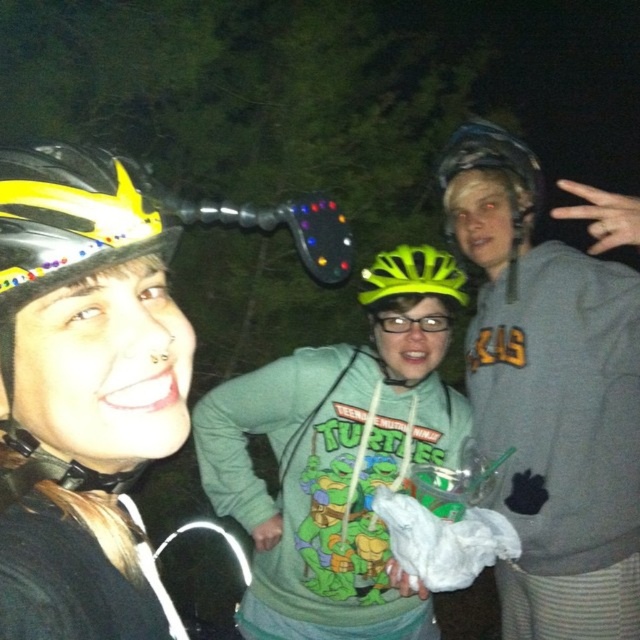
Can you confirm if green matte helmet at center is taller than green matte glasses at center?

Yes, green matte helmet at center is taller than green matte glasses at center.

Does green matte helmet at center appear under green matte glasses at center?

No.

Who is more distant from viewer, (426, 248) or (433, 316)?

Point (426, 248)

What are the coordinates of `green matte helmet at center` in the screenshot? It's located at (412, 275).

Can you confirm if yellow shiny helmet at left is bigger than yellow matte bicycle helmet at left?

Yes.

Does point (140, 186) come farther from viewer compared to point (13, 276)?

Yes, point (140, 186) is farther from viewer.

I want to click on yellow shiny helmet at left, so point(64,248).

Is point (122, 232) positioned before point (448, 330)?

Yes, it is in front of point (448, 330).

Is point (36, 192) more distant than point (429, 330)?

No, (36, 192) is in front of (429, 330).

Is point (172, 240) positioned after point (392, 316)?

No, (172, 240) is in front of (392, 316).

Where is `yellow shiny helmet at left`? The image size is (640, 640). yellow shiny helmet at left is located at coordinates (64, 248).